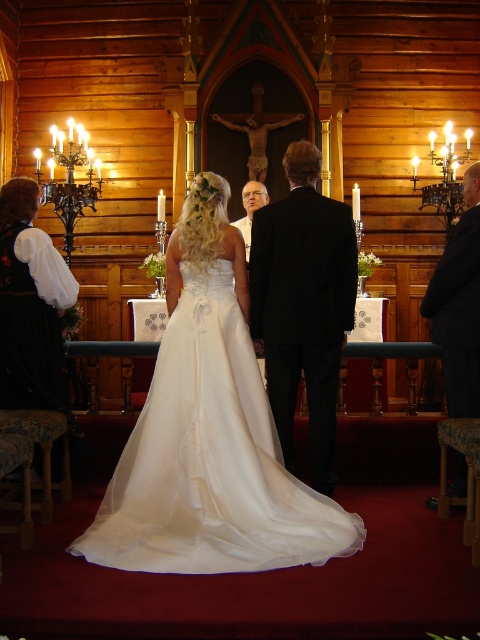
You are a photographer at the wedding ceremony. You need to capture a photo that includes both the black satin suit at center and the black suit at right. Which one is positioned lower in the frame?

The black satin suit at center is located below the black suit at right, so it is positioned lower in the frame.

From the picture: You are a photographer at the wedding ceremony inside the wooden church. You need to capture a photo that includes both the black satin suit at center and the white satin dress at left. Considering their sizes, which one should you focus on to ensure both are clearly visible in the frame?

The black satin suit at center is larger in size than the white satin dress at left, so you should focus on the black satin suit at center to ensure both are clearly visible in the frame.